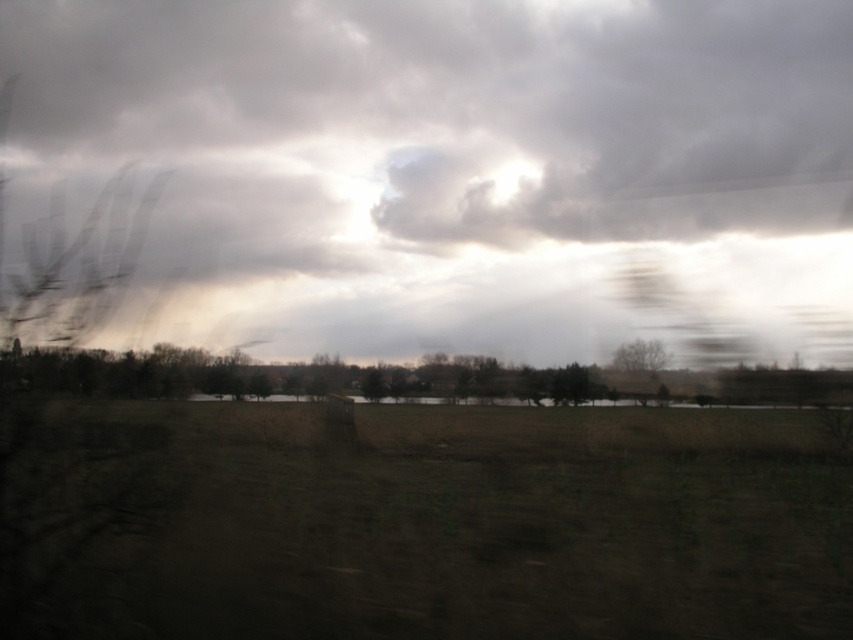
Question: Considering the relative positions of cloudy textured sky at center and brown matte tree at center-right in the image provided, where is cloudy textured sky at center located with respect to brown matte tree at center-right?

Choices:
 (A) below
 (B) above

Answer: (B)

Question: Among these objects, which one is farthest from the camera?

Choices:
 (A) green matte tree at center
 (B) brown matte tree at center-right

Answer: (A)

Question: Is cloudy textured sky at center wider than green matte tree at center?

Choices:
 (A) no
 (B) yes

Answer: (B)

Question: Does cloudy textured sky at center appear on the left side of green matte tree at center?

Choices:
 (A) no
 (B) yes

Answer: (A)

Question: Which point is closer to the camera?

Choices:
 (A) (374, 378)
 (B) (134, 32)

Answer: (B)

Question: Estimate the real-world distances between objects in this image. Which object is farther from the cloudy textured sky at center?

Choices:
 (A) green matte tree at center
 (B) brown matte tree at center-right

Answer: (A)